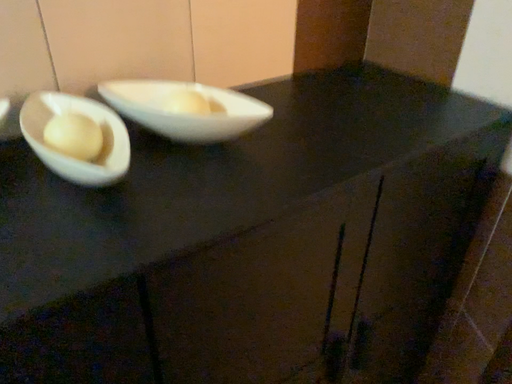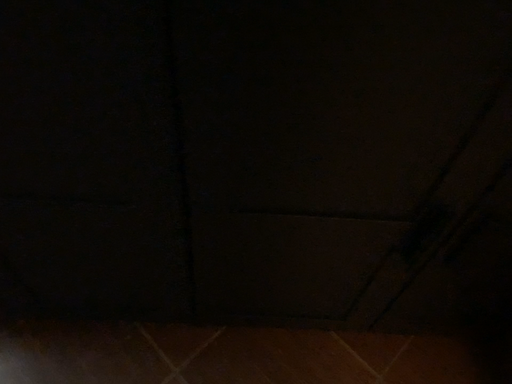
Question: How did the camera likely rotate when shooting the video?

Choices:
 (A) rotated downward
 (B) rotated upward

Answer: (A)